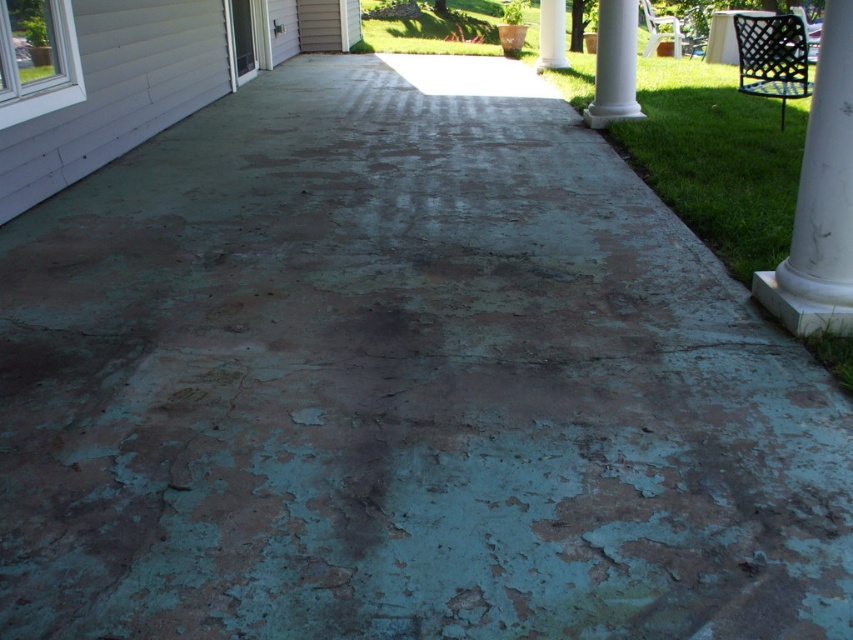
Question: Is white smooth column at upper center bigger than white smooth column at center?

Choices:
 (A) no
 (B) yes

Answer: (B)

Question: Which of the following is the farthest from the observer?

Choices:
 (A) (596, 45)
 (B) (537, 70)

Answer: (B)

Question: Which point appears farthest from the camera in this image?

Choices:
 (A) (541, 68)
 (B) (621, 20)
 (C) (849, 65)

Answer: (A)

Question: Can you confirm if white smooth column at upper center is bigger than white smooth column at center?

Choices:
 (A) no
 (B) yes

Answer: (B)

Question: Which of the following is the closest to the observer?

Choices:
 (A) white marble pillar at right
 (B) white smooth column at upper center

Answer: (A)

Question: Does white marble pillar at right appear over white smooth column at center?

Choices:
 (A) no
 (B) yes

Answer: (A)